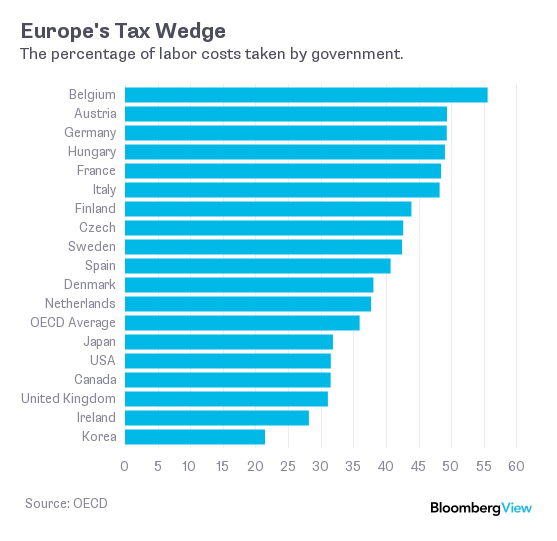
I want to click on the longest bar, so click(476, 92).